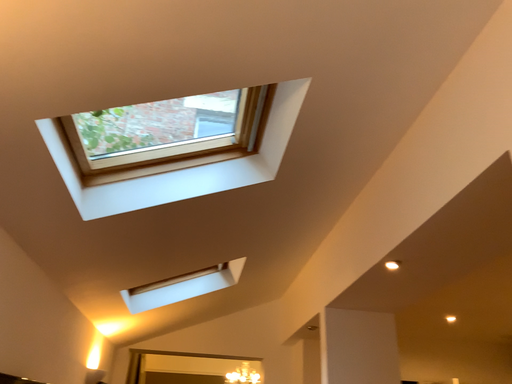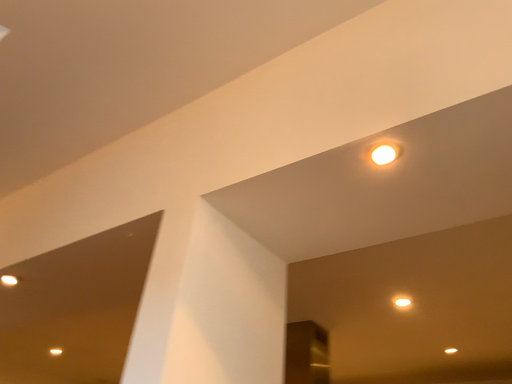
Question: How did the camera likely rotate when shooting the video?

Choices:
 (A) rotated downward
 (B) rotated upward

Answer: (A)